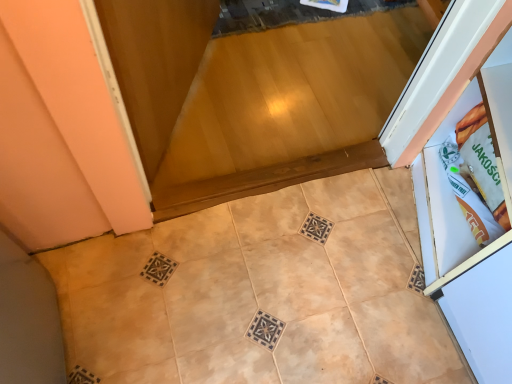
Describe the element at coordinates (209, 301) in the screenshot. I see `beige matte tile at center, placed as the first ceramic tile when sorted from left to right` at that location.

The height and width of the screenshot is (384, 512). What are the coordinates of `beige matte tile at center, the second ceramic tile when ordered from right to left` in the screenshot? It's located at (209, 301).

Measure the distance between point (208, 291) and camera.

The depth of point (208, 291) is 1.24 meters.

The width and height of the screenshot is (512, 384). What do you see at coordinates (256, 296) in the screenshot?
I see `beige matte tile at lower left, the 1th ceramic tile viewed from the right` at bounding box center [256, 296].

The height and width of the screenshot is (384, 512). I want to click on beige matte tile at lower left, the 2th ceramic tile in the left-to-right sequence, so click(x=256, y=296).

Find the location of a particular element. beige matte tile at center, placed as the first ceramic tile when sorted from left to right is located at coordinates click(209, 301).

Is beige matte tile at lower left, the 1th ceramic tile viewed from the right, at the right side of beige matte tile at center, the second ceramic tile when ordered from right to left?

Yes.

Which object is more forward, beige matte tile at lower left, the 1th ceramic tile viewed from the right, or beige matte tile at center, the second ceramic tile when ordered from right to left?

Positioned in front is beige matte tile at lower left, the 1th ceramic tile viewed from the right.

Consider the image. Which is farther, (204, 303) or (225, 280)?

Positioned behind is point (225, 280).

From the image's perspective, between beige matte tile at lower left, the 2th ceramic tile in the left-to-right sequence, and beige matte tile at center, the second ceramic tile when ordered from right to left, which one is located above?

beige matte tile at lower left, the 2th ceramic tile in the left-to-right sequence, from the image's perspective.

From a real-world perspective, is beige matte tile at lower left, the 2th ceramic tile in the left-to-right sequence, positioned under beige matte tile at center, the second ceramic tile when ordered from right to left, based on gravity?

No, from a real-world perspective, beige matte tile at lower left, the 2th ceramic tile in the left-to-right sequence, is not below beige matte tile at center, the second ceramic tile when ordered from right to left.

Is beige matte tile at lower left, the 1th ceramic tile viewed from the right, thinner than beige matte tile at center, the second ceramic tile when ordered from right to left?

Incorrect, the width of beige matte tile at lower left, the 1th ceramic tile viewed from the right, is not less than that of beige matte tile at center, the second ceramic tile when ordered from right to left.

Considering the sizes of beige matte tile at lower left, the 2th ceramic tile in the left-to-right sequence, and beige matte tile at center, placed as the first ceramic tile when sorted from left to right, in the image, is beige matte tile at lower left, the 2th ceramic tile in the left-to-right sequence, taller or shorter than beige matte tile at center, placed as the first ceramic tile when sorted from left to right,?

Clearly, beige matte tile at lower left, the 2th ceramic tile in the left-to-right sequence, is taller compared to beige matte tile at center, placed as the first ceramic tile when sorted from left to right.

Which of these two, beige matte tile at lower left, the 1th ceramic tile viewed from the right, or beige matte tile at center, the second ceramic tile when ordered from right to left, is smaller?

Smaller between the two is beige matte tile at center, the second ceramic tile when ordered from right to left.

In the scene shown: Is beige matte tile at center, the second ceramic tile when ordered from right to left, a part of beige matte tile at lower left, the 1th ceramic tile viewed from the right?

Yes, beige matte tile at center, the second ceramic tile when ordered from right to left, is a part of beige matte tile at lower left, the 1th ceramic tile viewed from the right.

Is beige matte tile at lower left, the 1th ceramic tile viewed from the right, with beige matte tile at center, placed as the first ceramic tile when sorted from left to right?

There is a gap between beige matte tile at lower left, the 1th ceramic tile viewed from the right, and beige matte tile at center, placed as the first ceramic tile when sorted from left to right.

Is beige matte tile at lower left, the 2th ceramic tile in the left-to-right sequence, looking in the opposite direction of beige matte tile at center, the second ceramic tile when ordered from right to left?

Correct, beige matte tile at lower left, the 2th ceramic tile in the left-to-right sequence, is looking away from beige matte tile at center, the second ceramic tile when ordered from right to left.

What's the angular difference between beige matte tile at lower left, the 1th ceramic tile viewed from the right, and beige matte tile at center, placed as the first ceramic tile when sorted from left to right,'s facing directions?

The angle between the facing direction of beige matte tile at lower left, the 1th ceramic tile viewed from the right, and the facing direction of beige matte tile at center, placed as the first ceramic tile when sorted from left to right, is 32.5 degrees.

Image resolution: width=512 pixels, height=384 pixels. I want to click on ceramic tile on the left of beige matte tile at lower left, the 1th ceramic tile viewed from the right, so click(x=209, y=301).

Can you confirm if beige matte tile at center, the second ceramic tile when ordered from right to left, is positioned to the right of beige matte tile at lower left, the 1th ceramic tile viewed from the right?

Incorrect, beige matte tile at center, the second ceramic tile when ordered from right to left, is not on the right side of beige matte tile at lower left, the 1th ceramic tile viewed from the right.

Is the position of beige matte tile at center, placed as the first ceramic tile when sorted from left to right, less distant than that of beige matte tile at lower left, the 1th ceramic tile viewed from the right?

No, it is behind beige matte tile at lower left, the 1th ceramic tile viewed from the right.

Is point (186, 344) positioned before point (362, 195)?

Yes, it is in front of point (362, 195).

From the image's perspective, between beige matte tile at center, placed as the first ceramic tile when sorted from left to right, and beige matte tile at lower left, the 2th ceramic tile in the left-to-right sequence, who is located below?

→ beige matte tile at center, placed as the first ceramic tile when sorted from left to right, appears lower in the image.

From a real-world perspective, is beige matte tile at center, placed as the first ceramic tile when sorted from left to right, physically located above or below beige matte tile at lower left, the 1th ceramic tile viewed from the right?

Clearly, from a real-world perspective, beige matte tile at center, placed as the first ceramic tile when sorted from left to right, is below beige matte tile at lower left, the 1th ceramic tile viewed from the right.

Considering the sizes of objects beige matte tile at center, the second ceramic tile when ordered from right to left, and beige matte tile at lower left, the 1th ceramic tile viewed from the right, in the image provided, who is thinner, beige matte tile at center, the second ceramic tile when ordered from right to left, or beige matte tile at lower left, the 1th ceramic tile viewed from the right,?

beige matte tile at center, the second ceramic tile when ordered from right to left, is thinner.

Which of these two, beige matte tile at center, the second ceramic tile when ordered from right to left, or beige matte tile at lower left, the 2th ceramic tile in the left-to-right sequence, stands shorter?

beige matte tile at center, the second ceramic tile when ordered from right to left, is shorter.

Based on the photo, is beige matte tile at center, the second ceramic tile when ordered from right to left, bigger or smaller than beige matte tile at lower left, the 1th ceramic tile viewed from the right?

Clearly, beige matte tile at center, the second ceramic tile when ordered from right to left, is smaller in size than beige matte tile at lower left, the 1th ceramic tile viewed from the right.

Is beige matte tile at center, placed as the first ceramic tile when sorted from left to right, inside the boundaries of beige matte tile at lower left, the 1th ceramic tile viewed from the right, or outside?

beige matte tile at center, placed as the first ceramic tile when sorted from left to right, is spatially positioned inside beige matte tile at lower left, the 1th ceramic tile viewed from the right.

Is beige matte tile at center, placed as the first ceramic tile when sorted from left to right, far from beige matte tile at lower left, the 1th ceramic tile viewed from the right?

No, beige matte tile at center, placed as the first ceramic tile when sorted from left to right, is not far away from beige matte tile at lower left, the 1th ceramic tile viewed from the right.

Does beige matte tile at center, placed as the first ceramic tile when sorted from left to right, turn towards beige matte tile at lower left, the 2th ceramic tile in the left-to-right sequence?

Yes, beige matte tile at center, placed as the first ceramic tile when sorted from left to right, is facing beige matte tile at lower left, the 2th ceramic tile in the left-to-right sequence.

This screenshot has height=384, width=512. In order to click on ceramic tile above the beige matte tile at center, the second ceramic tile when ordered from right to left (from the image's perspective) in this screenshot , I will do `click(256, 296)`.

What are the coordinates of `ceramic tile that is below the beige matte tile at lower left, the 2th ceramic tile in the left-to-right sequence (from the image's perspective)` in the screenshot? It's located at (209, 301).

The height and width of the screenshot is (384, 512). Find the location of `ceramic tile on the left of beige matte tile at lower left, the 1th ceramic tile viewed from the right`. ceramic tile on the left of beige matte tile at lower left, the 1th ceramic tile viewed from the right is located at coordinates (209, 301).